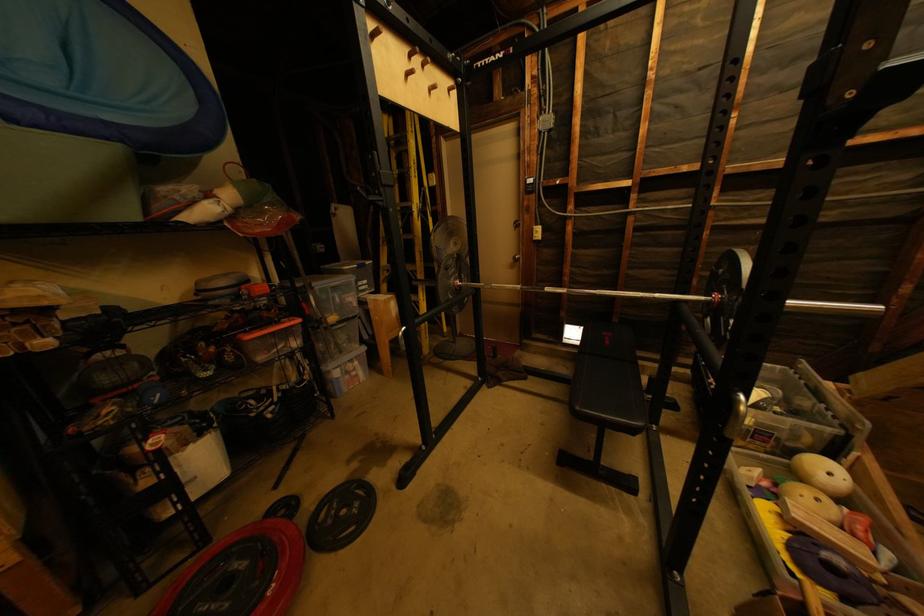
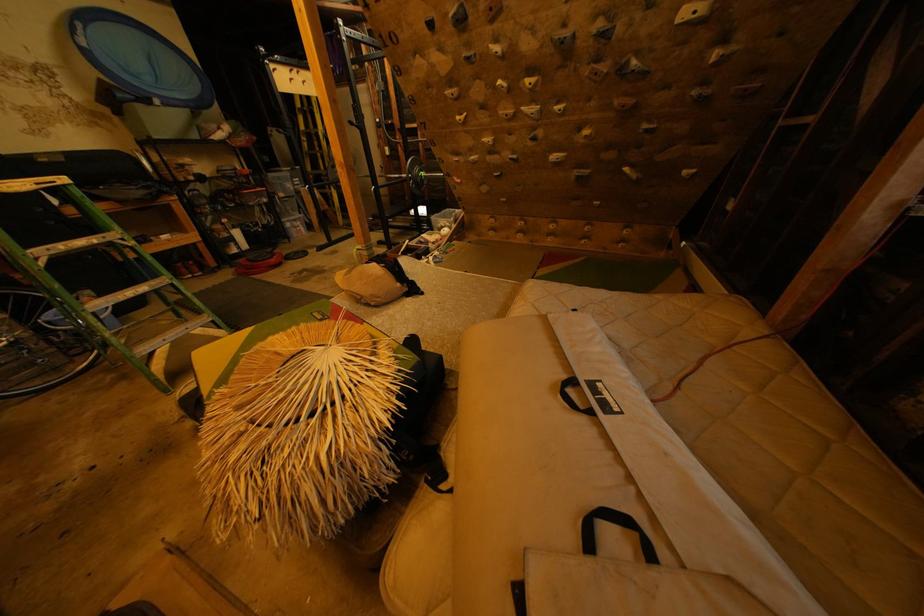
Looking at this image, in a continuous first-person perspective shot, in which direction is the camera moving?

The cameraman moved toward right, backward.